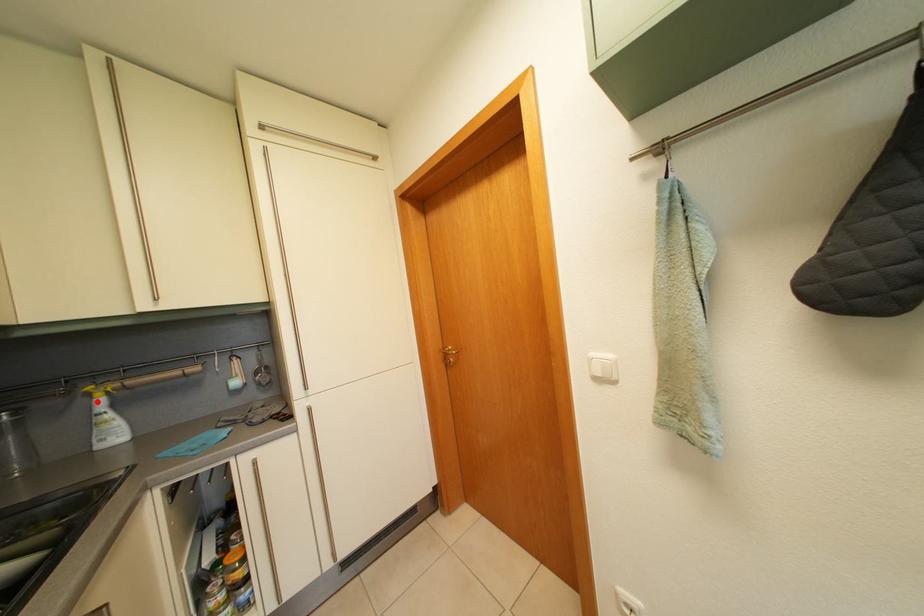
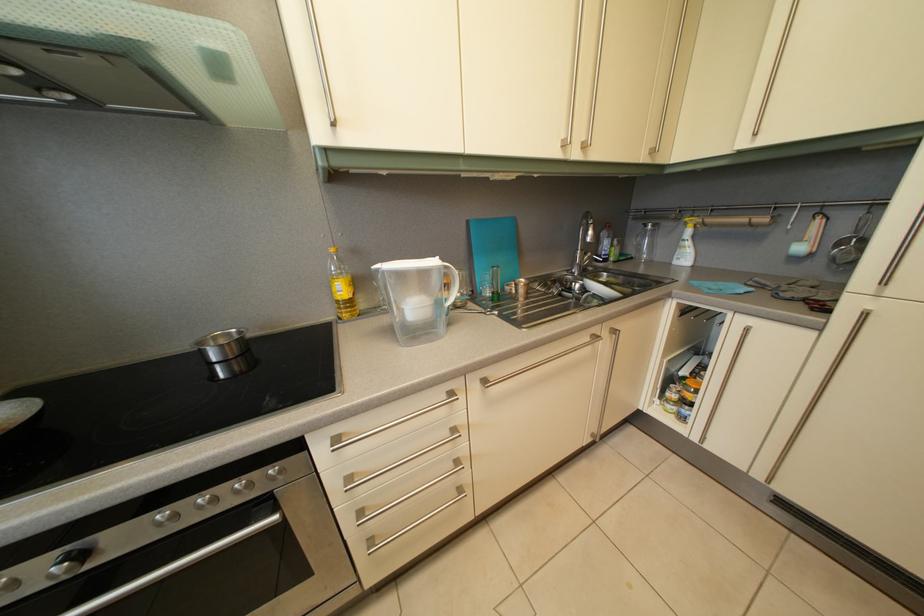
Find the pixel in the second image that matches the highlighted location in the first image.

(694, 232)